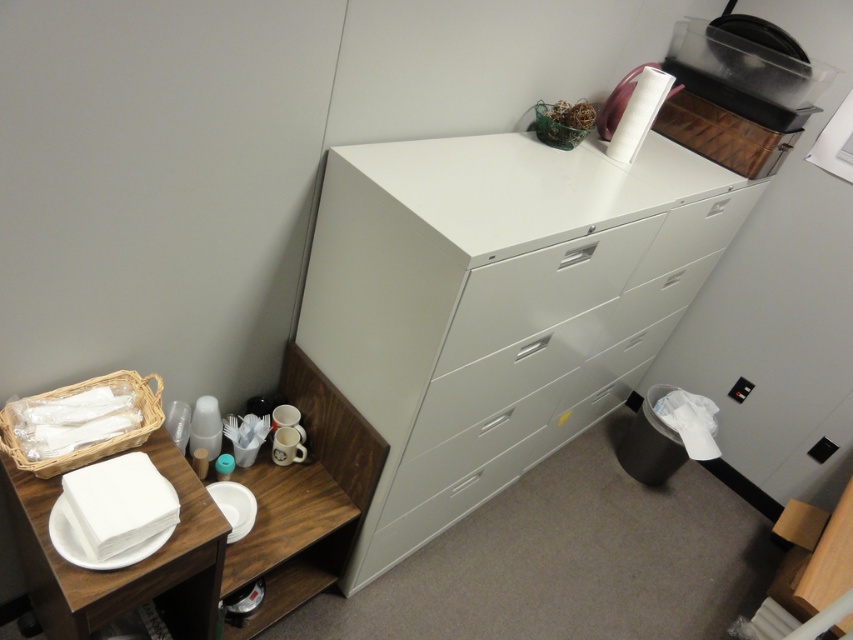
You are organizing items in the office corner and need to place a new item on the highest available surface. The surfaces you can use are the white matte drawer at center and the white matte plate at lower left. Which surface should you choose?

The white matte drawer at center is above the white matte plate at lower left, so you should place the new item on the white matte drawer at center since it is higher.

You need to place a new item between the white paper plate at lower left and the white matte plate at lower left. Is there enough space to fit something in between them?

The white paper plate at lower left is to the left of the white matte plate at lower left, so there is space between them to place an item.